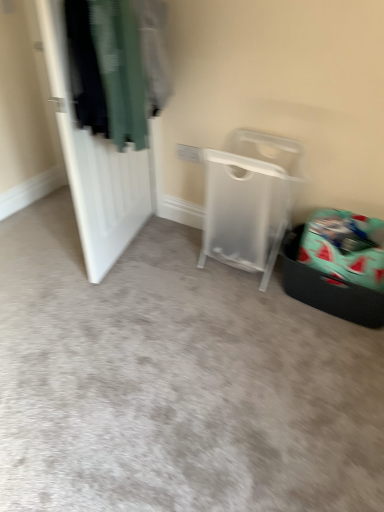
Question: From the image's perspective, is white matte door at left beneath transparent plastic laundry basket at center?

Choices:
 (A) yes
 (B) no

Answer: (B)

Question: Considering the relative sizes of white matte door at left and transparent plastic laundry basket at center in the image provided, is white matte door at left bigger than transparent plastic laundry basket at center?

Choices:
 (A) no
 (B) yes

Answer: (A)

Question: Considering the relative sizes of white matte door at left and transparent plastic laundry basket at center in the image provided, is white matte door at left shorter than transparent plastic laundry basket at center?

Choices:
 (A) yes
 (B) no

Answer: (B)

Question: Is white matte door at left further to the viewer compared to transparent plastic laundry basket at center?

Choices:
 (A) no
 (B) yes

Answer: (A)

Question: Would you consider white matte door at left to be distant from transparent plastic laundry basket at center?

Choices:
 (A) yes
 (B) no

Answer: (B)

Question: Considering the relative sizes of white matte door at left and transparent plastic laundry basket at center in the image provided, is white matte door at left taller than transparent plastic laundry basket at center?

Choices:
 (A) yes
 (B) no

Answer: (A)

Question: Is teal fabric laundry basket at lower right positioned beyond the bounds of transparent plastic laundry basket at center?

Choices:
 (A) yes
 (B) no

Answer: (A)

Question: Does teal fabric laundry basket at lower right have a lesser height compared to transparent plastic laundry basket at center?

Choices:
 (A) yes
 (B) no

Answer: (A)

Question: Considering the relative positions of teal fabric laundry basket at lower right and transparent plastic laundry basket at center in the image provided, is teal fabric laundry basket at lower right behind transparent plastic laundry basket at center?

Choices:
 (A) yes
 (B) no

Answer: (A)

Question: Does teal fabric laundry basket at lower right have a larger size compared to transparent plastic laundry basket at center?

Choices:
 (A) yes
 (B) no

Answer: (B)

Question: From a real-world perspective, is teal fabric laundry basket at lower right positioned over transparent plastic laundry basket at center based on gravity?

Choices:
 (A) yes
 (B) no

Answer: (B)

Question: Is teal fabric laundry basket at lower right positioned with its back to transparent plastic laundry basket at center?

Choices:
 (A) yes
 (B) no

Answer: (B)

Question: Is transparent plastic laundry basket at center oriented towards teal fabric laundry basket at lower right?

Choices:
 (A) no
 (B) yes

Answer: (A)